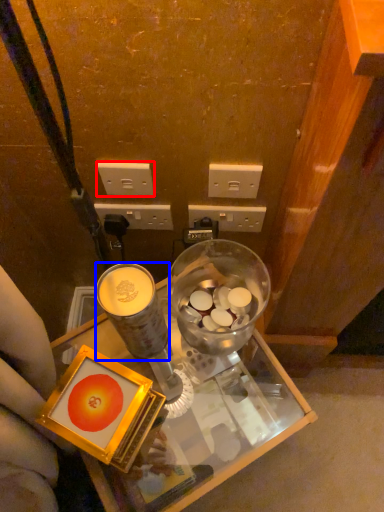
Question: Which point is closer to the camera, power outlet (highlighted by a red box) or coffee cup (highlighted by a blue box)?

Choices:
 (A) power outlet
 (B) coffee cup

Answer: (B)